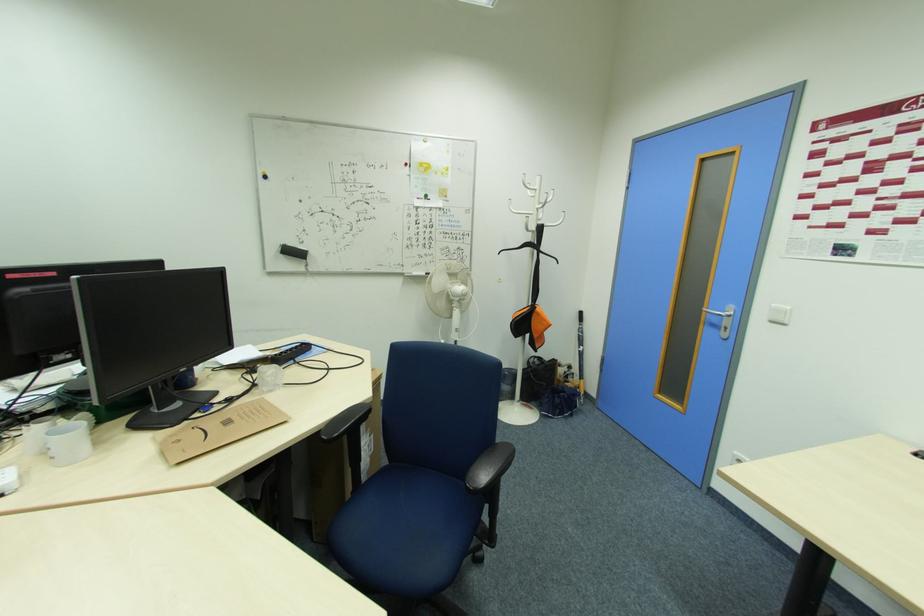
Where is `silver door handle`? The image size is (924, 616). silver door handle is located at coordinates tap(721, 312).